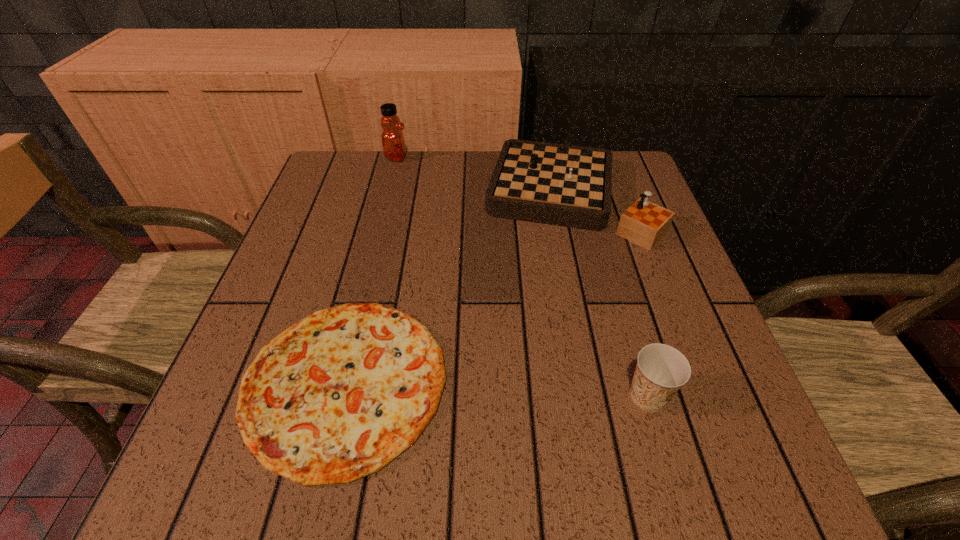
Where is `vacant point located between the honey and the shortest object`? The width and height of the screenshot is (960, 540). vacant point located between the honey and the shortest object is located at coordinates (371, 270).

I want to click on vacant region between the tallest object and the pizza, so click(x=371, y=270).

At what (x,y) coordinates should I click in order to perform the action: click on vacant area that lies between the tallest object and the Dixie cup. Please return your answer as a coordinate pair (x, y). The image size is (960, 540). Looking at the image, I should click on (522, 276).

Locate an element on the screen. The image size is (960, 540). the closest object to the tallest object is located at coordinates (566, 185).

Point out which object is positioned as the second nearest to the tallest object. Please provide its 2D coordinates. Your answer should be formatted as a tuple, i.e. [(x, y)], where the tuple contains the x and y coordinates of a point satisfying the conditions above.

[(337, 396)]

The height and width of the screenshot is (540, 960). In order to click on vacant space that satisfies the following two spatial constraints: 1. on the back side of the pizza; 2. on the left side of the chessboard in this screenshot , I will do `click(390, 197)`.

Locate an element on the screen. This screenshot has height=540, width=960. vacant space that satisfies the following two spatial constraints: 1. on the front label of the tallest object; 2. on the right side of the chessboard is located at coordinates (387, 197).

The height and width of the screenshot is (540, 960). What are the coordinates of `blank space that satisfies the following two spatial constraints: 1. on the back side of the pizza; 2. on the front label of the tallest object` in the screenshot? It's located at (399, 157).

You are a GUI agent. You are given a task and a screenshot of the screen. Output one action in this format:
    pyautogui.click(x=<x>, y=<y>)
    Task: Click on the free point that satisfies the following two spatial constraints: 1. on the back side of the pizza; 2. on the right side of the chessboard
    This screenshot has height=540, width=960.
    Given the screenshot: What is the action you would take?
    pyautogui.click(x=390, y=197)

The image size is (960, 540). Identify the location of vacant point that satisfies the following two spatial constraints: 1. on the front label of the honey; 2. on the back side of the Dixie cup. (338, 396).